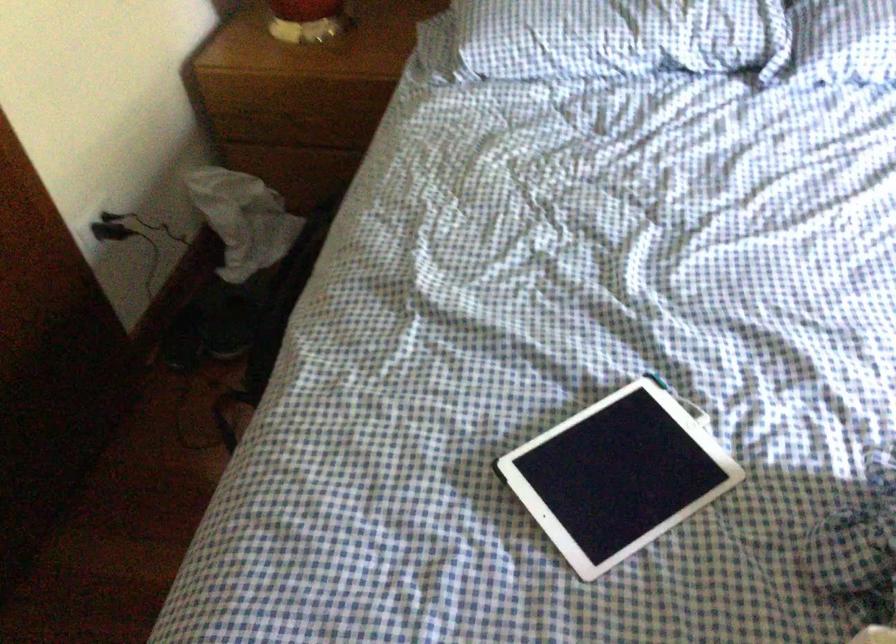
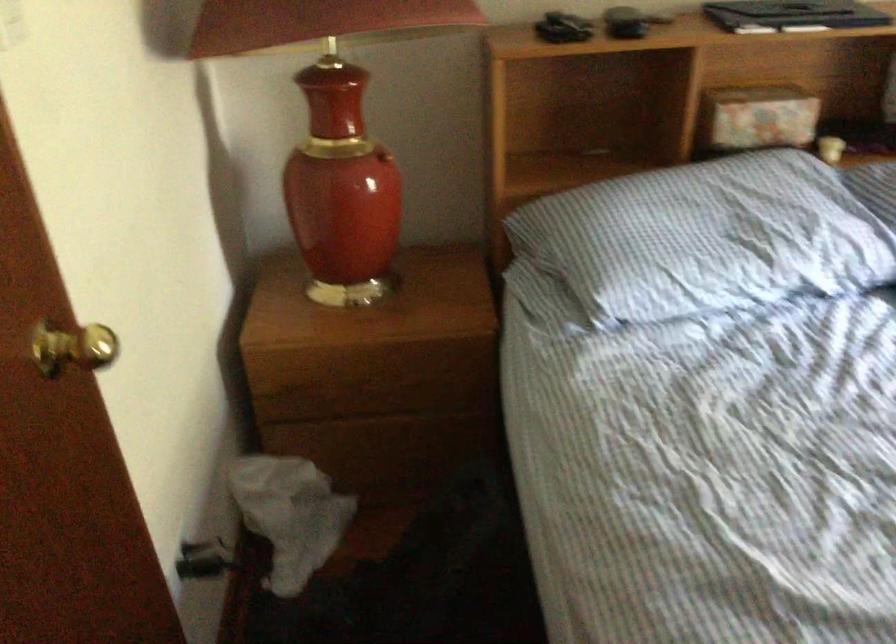
Question: The first image is from the beginning of the video and the second image is from the end. How did the camera likely rotate when shooting the video?

Choices:
 (A) Left
 (B) Right
 (C) Up
 (D) Down

Answer: (B)